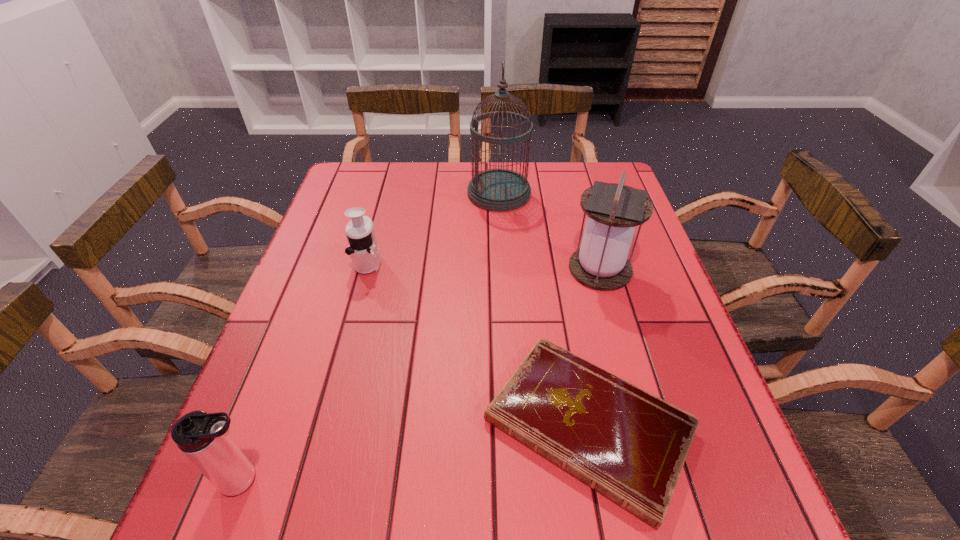
What are the coordinates of `vacant space located 0.160m on the left of the lantern` in the screenshot? It's located at (505, 269).

Locate an element on the screen. vacant region located 0.180m on the handle side of the leftmost object is located at coordinates (380, 480).

Locate an element on the screen. The height and width of the screenshot is (540, 960). blank area located on the back of the fourth object from right to left is located at coordinates (388, 190).

The width and height of the screenshot is (960, 540). What are the coordinates of `vacant space located on the left of the notebook` in the screenshot? It's located at (264, 425).

Identify the location of object that is at the far edge. (499, 190).

Find the location of a particular element. thermos bottle positioned at the near edge is located at coordinates (203, 438).

At what (x,y) coordinates should I click in order to perform the action: click on notebook situated at the near edge. Please return your answer as a coordinate pair (x, y). The width and height of the screenshot is (960, 540). Looking at the image, I should click on (627, 444).

Identify the location of thermos bottle that is positioned at the left edge. This screenshot has width=960, height=540. (203, 438).

You are a GUI agent. You are given a task and a screenshot of the screen. Output one action in this format:
    pyautogui.click(x=<x>, y=<y>)
    Task: Click on the juicer that is at the left edge
    The height and width of the screenshot is (540, 960).
    Given the screenshot: What is the action you would take?
    pyautogui.click(x=363, y=249)

The height and width of the screenshot is (540, 960). I want to click on lantern that is at the right edge, so click(613, 210).